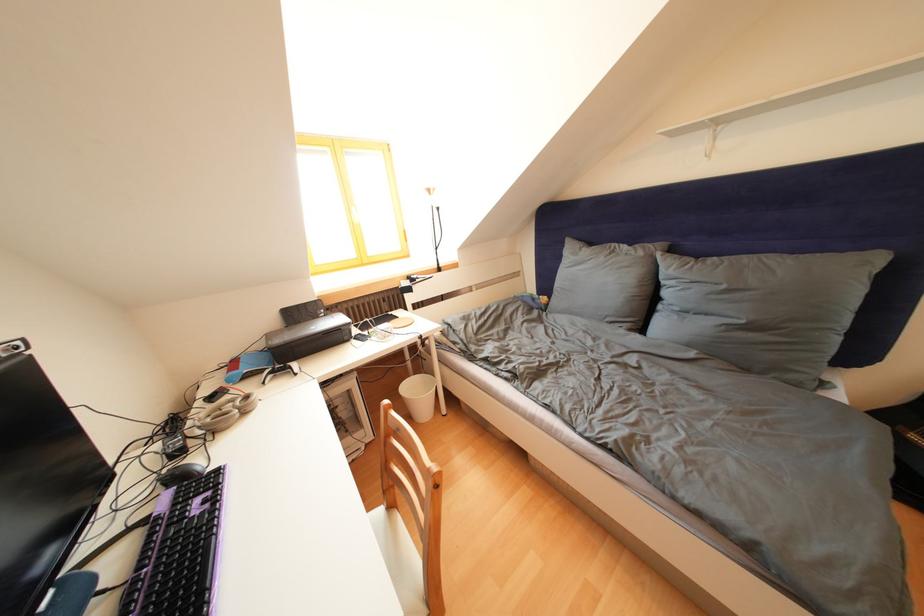
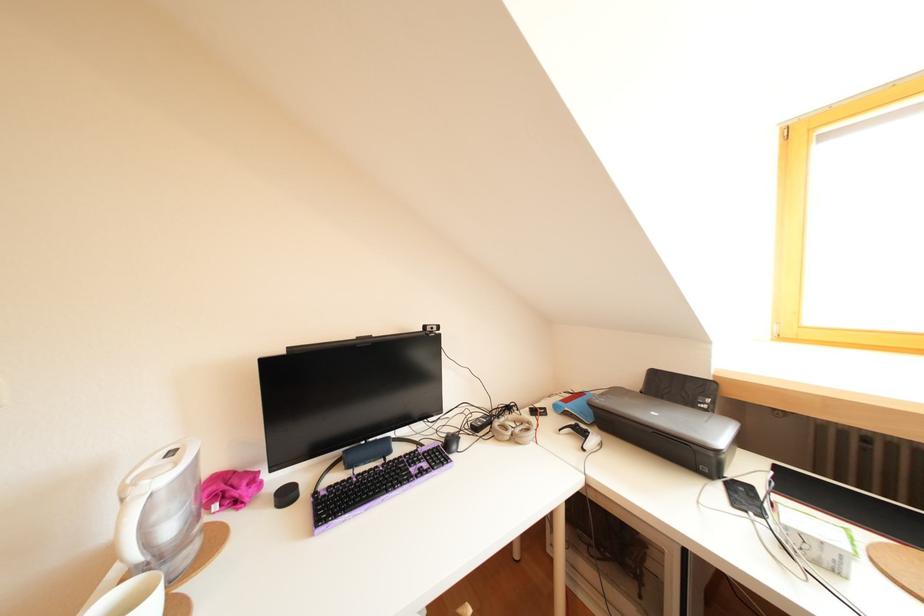
Question: The camera is either moving clockwise (left) or counter-clockwise (right) around the object. The first image is from the beginning of the video and the second image is from the end. Is the camera moving left or right when shooting the video?

Choices:
 (A) Left
 (B) Right

Answer: (B)